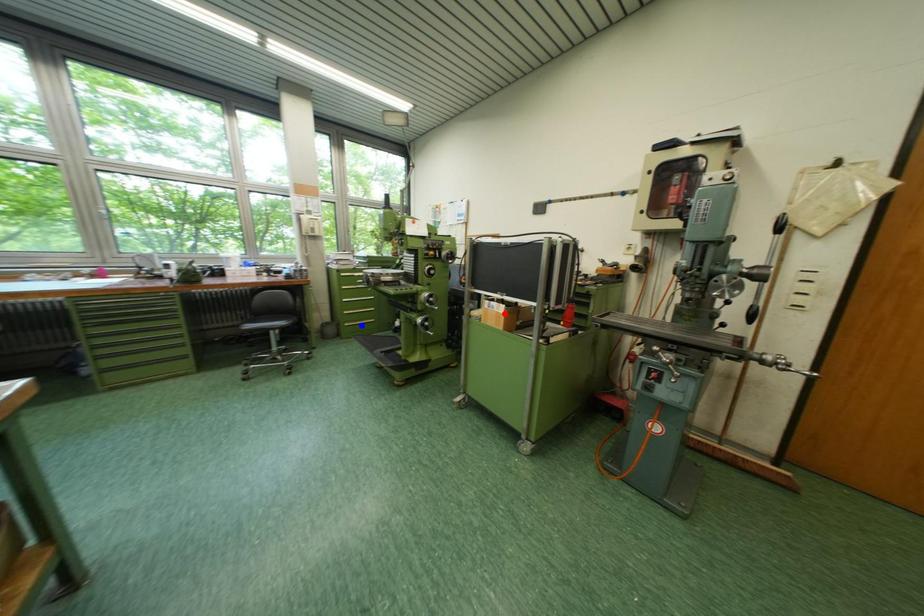
Question: In the image, two points are highlighted. Which point is nearer to the camera? Reply with the corresponding letter.

Choices:
 (A) blue point
 (B) red point

Answer: (B)